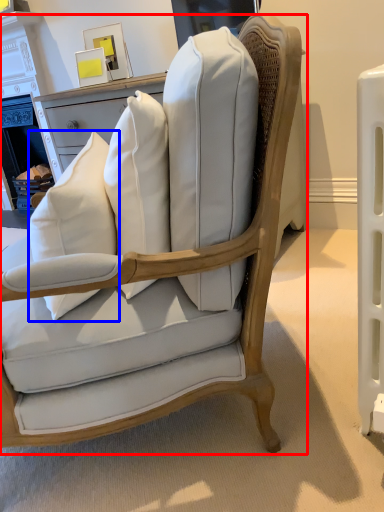
Question: Which point is closer to the camera, chair (highlighted by a red box) or throw pillow (highlighted by a blue box)?

Choices:
 (A) chair
 (B) throw pillow

Answer: (A)